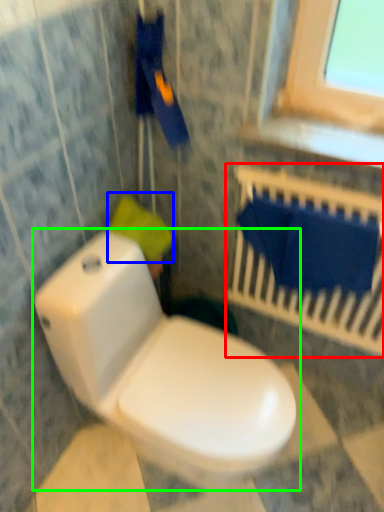
Question: Based on their relative distances, which object is farther from balustrade (highlighted by a red box)? Choose from toilet paper (highlighted by a blue box) and toilet (highlighted by a green box).

Choices:
 (A) toilet paper
 (B) toilet

Answer: (B)